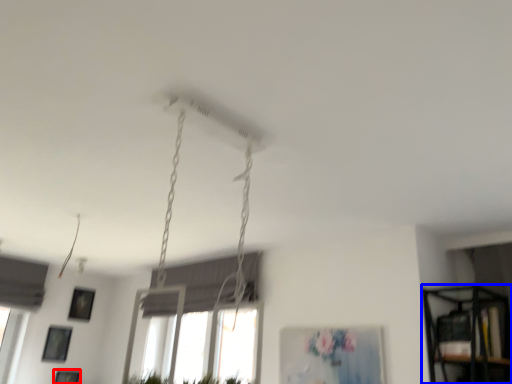
Question: Among these objects, which one is nearest to the camera, picture frame (highlighted by a red box) or shelf (highlighted by a blue box)?

Choices:
 (A) picture frame
 (B) shelf

Answer: (B)